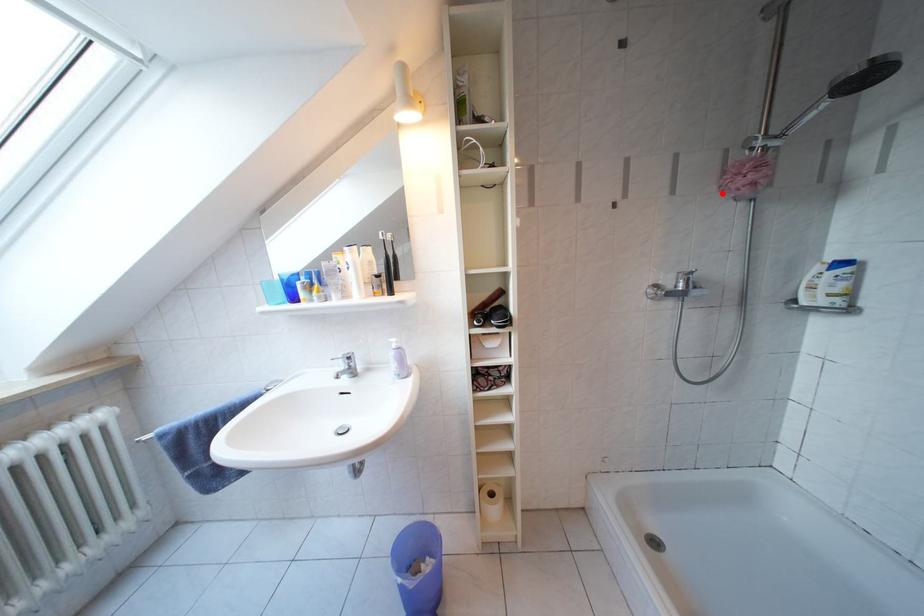
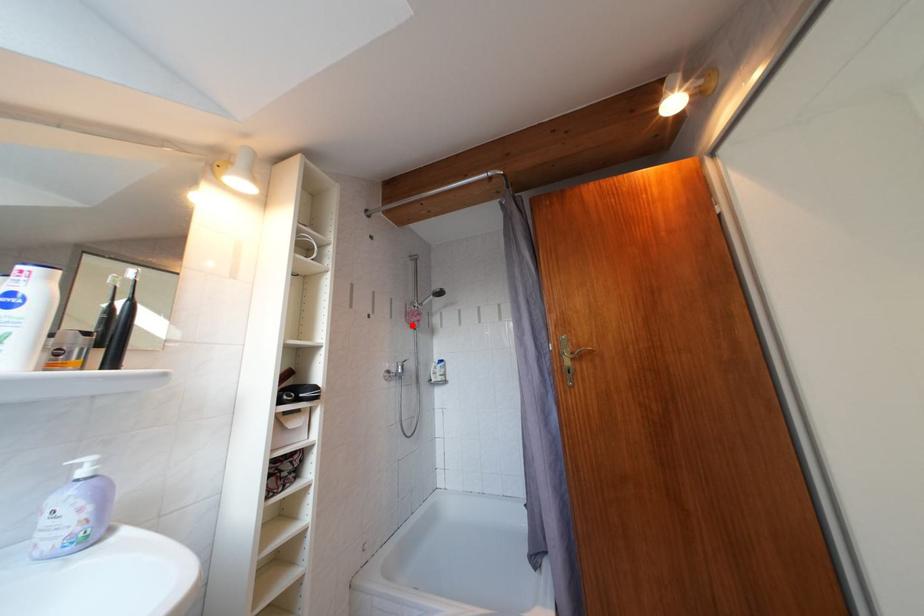
I am providing you with two images of the same scene from different viewpoints. A red point is marked on the first image and another point is marked on the second image. Are the points marked in image1 and image2 representing the same 3D position?

Yes